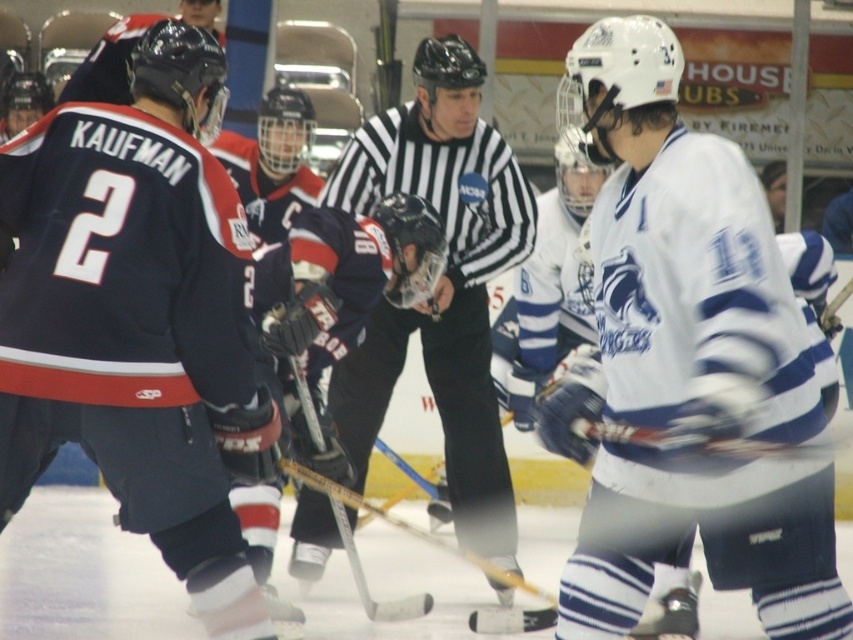
You are a spectator at the ice hockey game. You notice two central objects on the ice. One is the black and white striped shirt at center and the other is the wooden hockey stick at center. Which one is positioned to the right of the other?

The black and white striped shirt at center is to the right of the wooden hockey stick at center.

Based on the scene description, can you identify the object located at the coordinates point (440, 282)?

The point (440, 282) corresponds to the black and white striped shirt at center.

You are a referee standing at the center of the ice rink. You need to locate the black and white striped shirt at center. According to the coordinates provided, where exactly should you look to find it?

The black and white striped shirt at center is located at the coordinates point (440, 282).